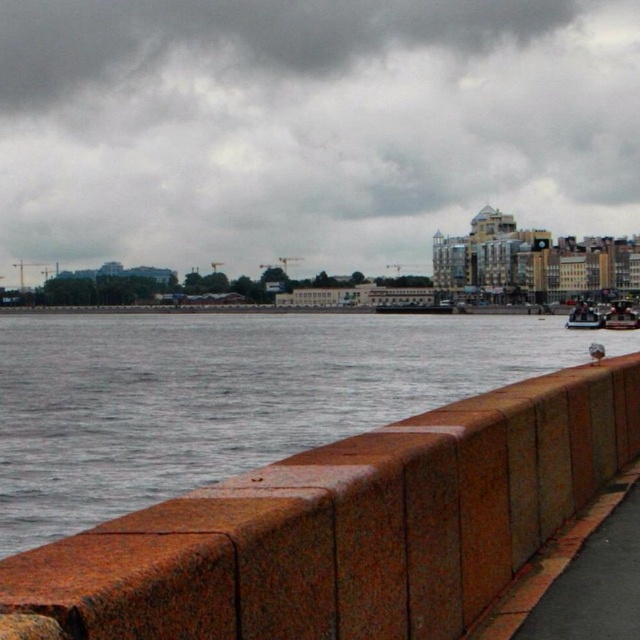
Question: Which object appears farthest from the camera in this image?

Choices:
 (A) metallic silver boat at lower right
 (B) wooden polished boat at right
 (C) cloudy gray sky at upper center

Answer: (C)

Question: Can you confirm if wooden polished boat at right is positioned above metallic silver boat at lower right?

Choices:
 (A) yes
 (B) no

Answer: (A)

Question: Among these points, which one is nearest to the camera?

Choices:
 (A) (609, 324)
 (B) (81, 177)
 (C) (193, 577)

Answer: (C)

Question: Is cloudy gray sky at upper center closer to the viewer compared to wooden polished boat at right?

Choices:
 (A) yes
 (B) no

Answer: (B)

Question: Which of the following is the closest to the observer?

Choices:
 (A) (541, 141)
 (B) (621, 308)
 (C) (358, 465)

Answer: (C)

Question: In this image, where is cloudy gray sky at upper center located relative to wooden polished boat at right?

Choices:
 (A) above
 (B) below

Answer: (A)